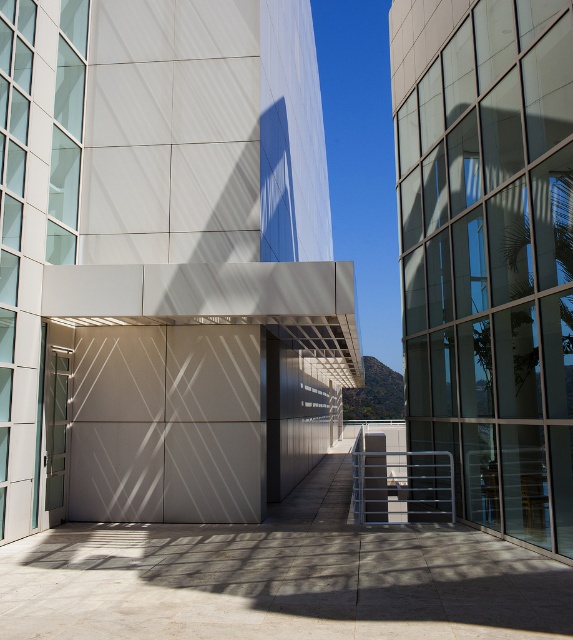
Question: Where is black metal balustrade at lower center located in relation to translucent glass door at center in the image?

Choices:
 (A) above
 (B) below

Answer: (B)

Question: Is black metal balustrade at lower center bigger than translucent glass door at center?

Choices:
 (A) yes
 (B) no

Answer: (A)

Question: From the image, what is the correct spatial relationship of black metal balustrade at lower center in relation to translucent glass door at center?

Choices:
 (A) right
 (B) left

Answer: (A)